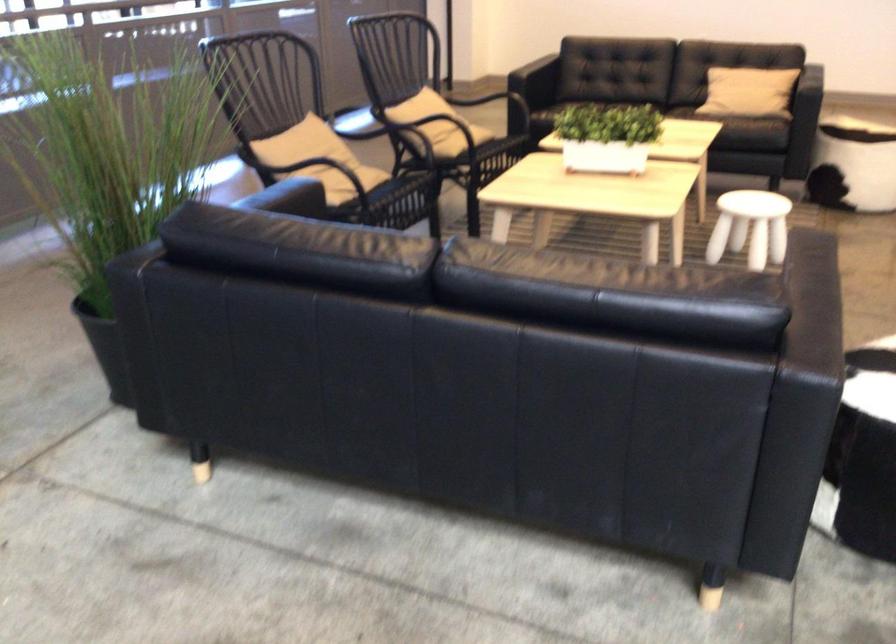
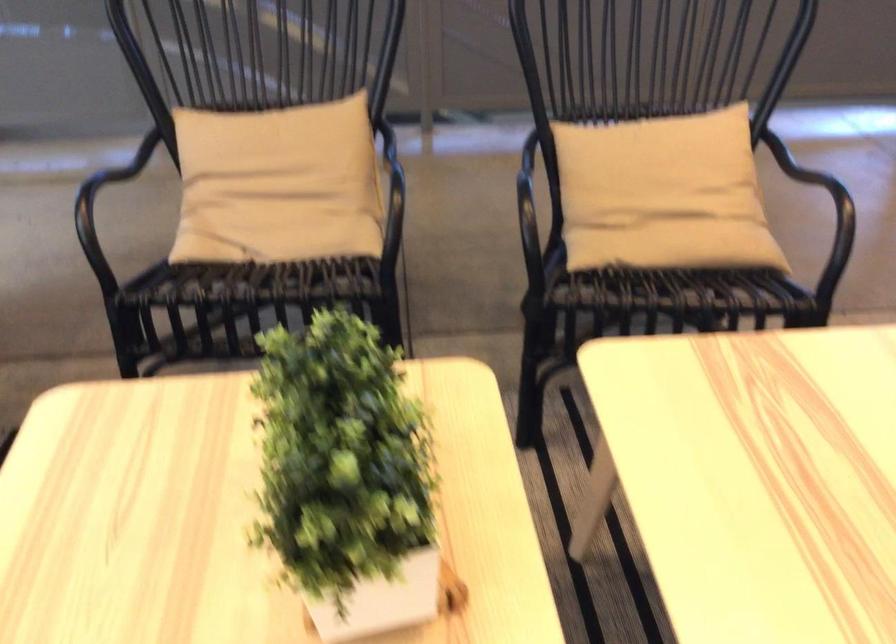
Where in the second image is the point corresponding to point 636,114 from the first image?

(346, 477)